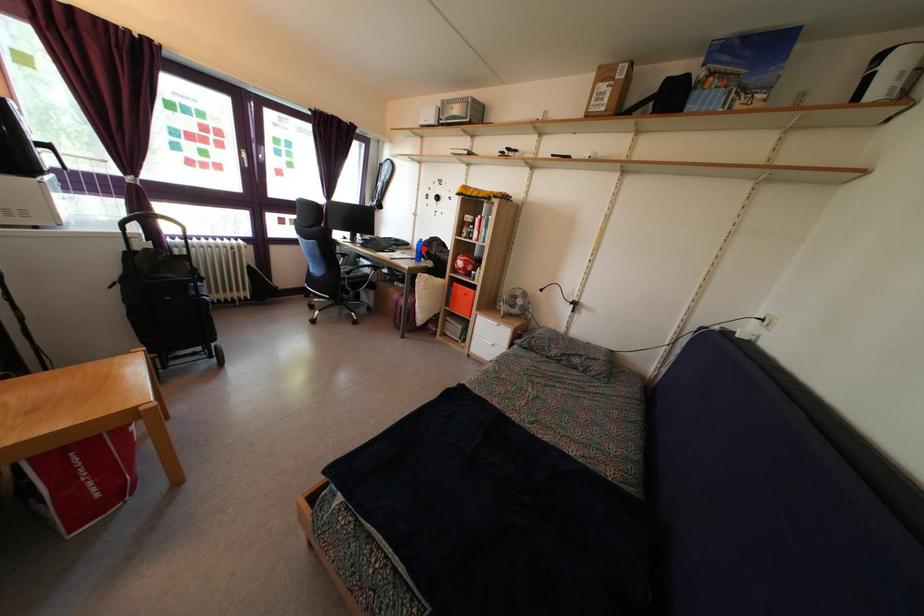
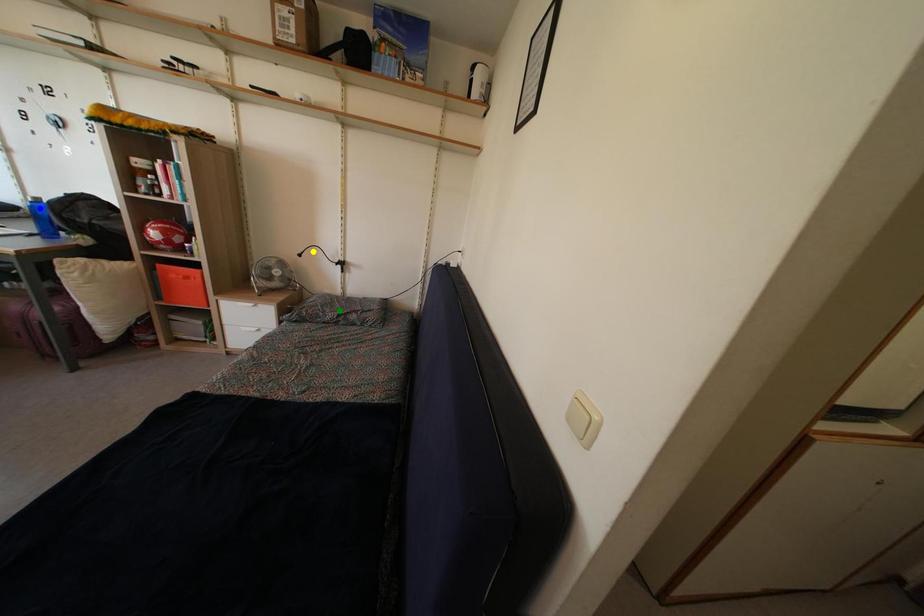
Question: I am providing you with two images of the same scene from different viewpoints. A red point is marked on the first image. You are given multiple points on the second image. Which point in image 2 represents the same 3d spot as the red point in image 1?

Choices:
 (A) green point
 (B) yellow point
 (C) blue point

Answer: (C)